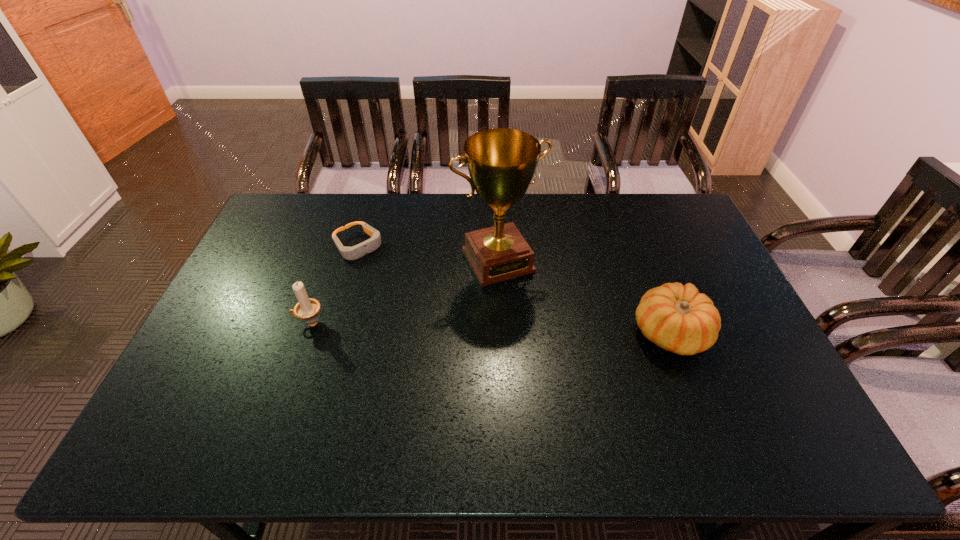
Identify the location of free space at the right edge of the desktop. The height and width of the screenshot is (540, 960). pos(659,236).

Image resolution: width=960 pixels, height=540 pixels. What are the coordinates of `vacant space at the near left corner of the desktop` in the screenshot? It's located at (230, 395).

Identify the location of vacant space at the far right corner of the desktop. (680, 201).

Locate an element on the screen. The width and height of the screenshot is (960, 540). free space at the near right corner of the desktop is located at coordinates (780, 403).

The height and width of the screenshot is (540, 960). What are the coordinates of `vacant region between the third object from left to right and the third tallest object` in the screenshot? It's located at (584, 297).

I want to click on vacant area between the second tallest object and the tallest object, so click(404, 292).

At what (x,y) coordinates should I click in order to perform the action: click on vacant area that lies between the tallest object and the candle_holder. Please return your answer as a coordinate pair (x, y). The width and height of the screenshot is (960, 540). Looking at the image, I should click on (404, 292).

Locate an element on the screen. Image resolution: width=960 pixels, height=540 pixels. blank region between the gourd and the third object from left to right is located at coordinates (584, 297).

The image size is (960, 540). I want to click on empty space that is in between the gourd and the award, so click(x=584, y=297).

This screenshot has width=960, height=540. What are the coordinates of `unoccupied area between the goggles and the third tallest object` in the screenshot? It's located at (514, 289).